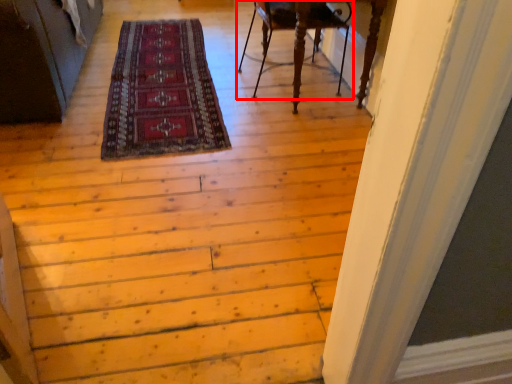
Question: From the image's perspective, what is the correct spatial positioning of chair (annotated by the red box) in reference to mat?

Choices:
 (A) above
 (B) below

Answer: (A)